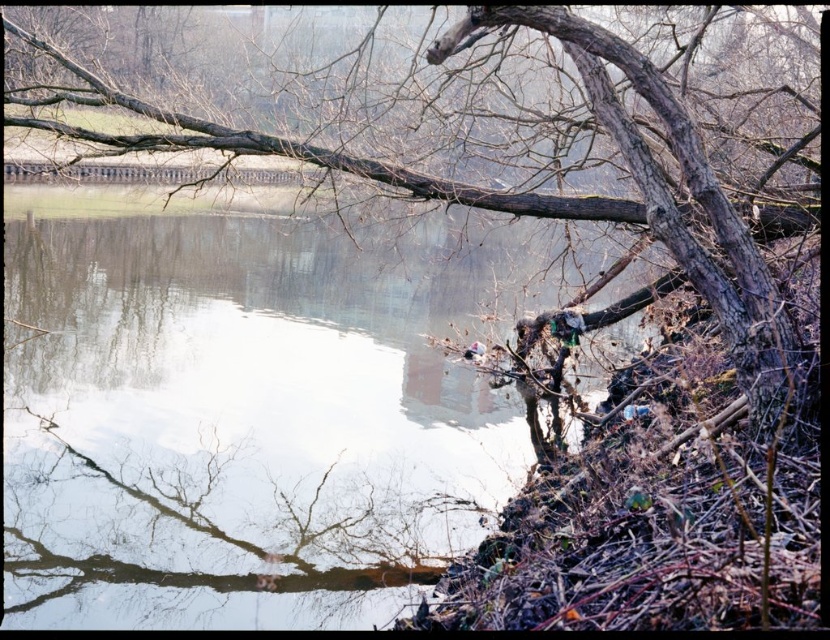
Between point (265, 468) and point (503, 4), which one is positioned in front?

Point (503, 4) is more forward.

Can you confirm if clear water at lower left is positioned below brown rough tree at upper right?

Indeed, clear water at lower left is positioned under brown rough tree at upper right.

Who is more forward, (105, 314) or (652, 72)?

Point (652, 72) is in front.

I want to click on clear water at lower left, so click(x=242, y=410).